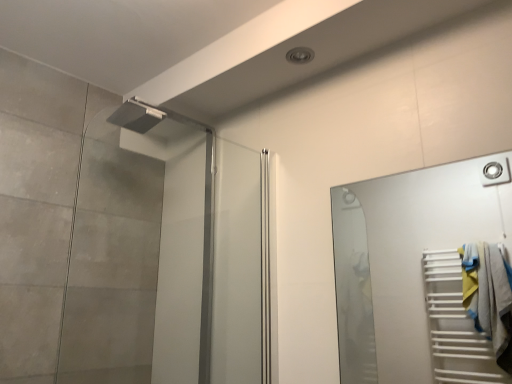
Question: Is matte silver shower head at upper left in front of or behind white glossy towel rack at right in the image?

Choices:
 (A) front
 (B) behind

Answer: (B)

Question: Which is correct: matte silver shower head at upper left is inside white glossy towel rack at right, or outside of it?

Choices:
 (A) inside
 (B) outside

Answer: (B)

Question: Considering the positions of point (138, 160) and point (468, 369), is point (138, 160) closer or farther from the camera than point (468, 369)?

Choices:
 (A) closer
 (B) farther

Answer: (A)

Question: From the image's perspective, is white glossy towel rack at right positioned above or below matte silver shower head at upper left?

Choices:
 (A) above
 (B) below

Answer: (B)

Question: Choose the correct answer: Is white glossy towel rack at right inside matte silver shower head at upper left or outside it?

Choices:
 (A) inside
 (B) outside

Answer: (B)

Question: From a real-world perspective, relative to matte silver shower head at upper left, is white glossy towel rack at right vertically above or below?

Choices:
 (A) below
 (B) above

Answer: (A)

Question: Does point (360, 334) appear closer or farther from the camera than point (101, 244)?

Choices:
 (A) farther
 (B) closer

Answer: (A)